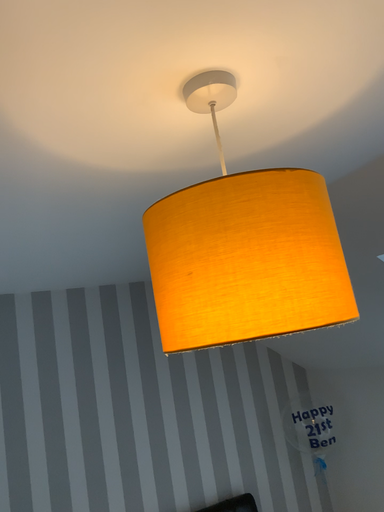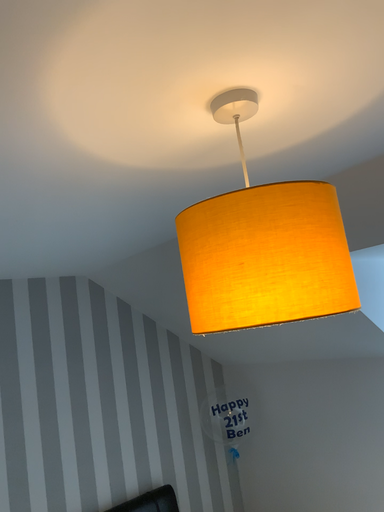
Question: How did the camera likely rotate when shooting the video?

Choices:
 (A) rotated right
 (B) rotated left

Answer: (A)